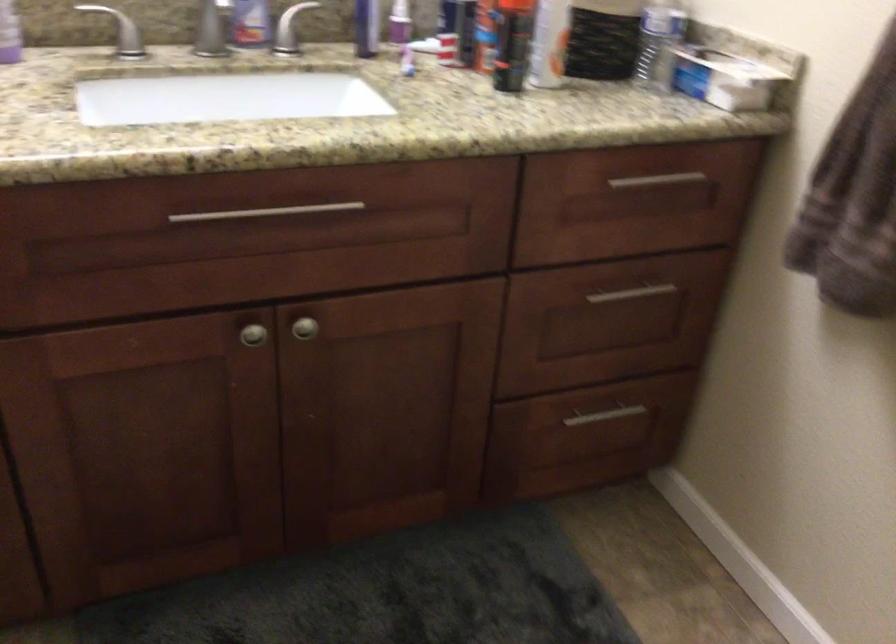
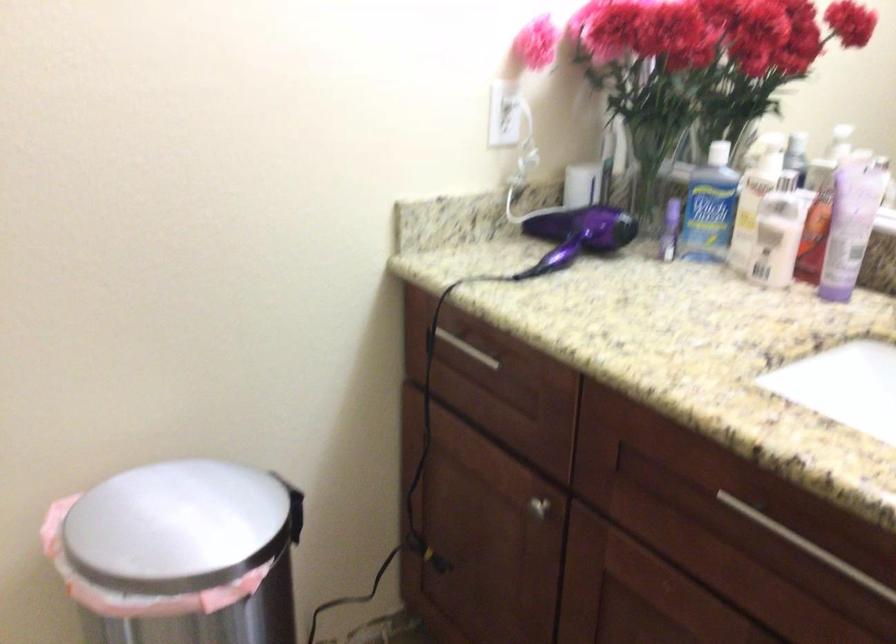
Question: How did the camera likely rotate?

Choices:
 (A) Left
 (B) Right
 (C) Up
 (D) Down

Answer: (A)